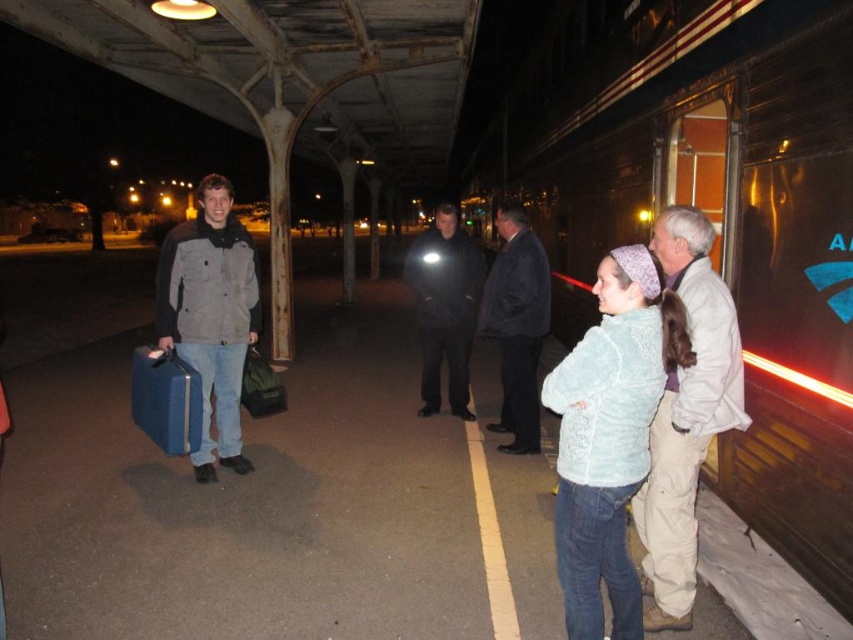
Question: Does dark blue jacket at center appear on the right side of black matte jacket at center?

Choices:
 (A) yes
 (B) no

Answer: (A)

Question: Among these objects, which one is farthest from the camera?

Choices:
 (A) light blue fuzzy sweater at right
 (B) blue hardshell suitcase at left

Answer: (B)

Question: Is gray fabric jacket at left behind dark blue jacket at center?

Choices:
 (A) yes
 (B) no

Answer: (B)

Question: Which point is farther to the camera?

Choices:
 (A) gray fabric jacket at left
 (B) dark blue jacket at center

Answer: (B)

Question: Which object appears closest to the camera in this image?

Choices:
 (A) black matte jacket at center
 (B) light blue sweater at right
 (C) gray fabric jacket at left
 (D) dark blue jacket at center

Answer: (B)

Question: Is light blue fuzzy sweater at right to the left of dark blue jacket at center from the viewer's perspective?

Choices:
 (A) yes
 (B) no

Answer: (B)